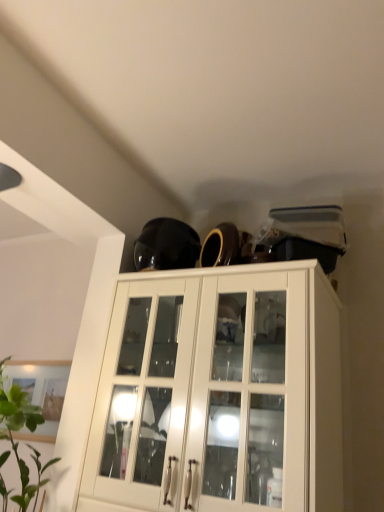
This screenshot has height=512, width=384. What do you see at coordinates (219, 394) in the screenshot? I see `white glossy cabinet at upper center` at bounding box center [219, 394].

This screenshot has width=384, height=512. Identify the location of white glossy cabinet at upper center. (219, 394).

What do you see at coordinates (17, 442) in the screenshot?
I see `green leafy plant at lower left` at bounding box center [17, 442].

The image size is (384, 512). In order to click on green leafy plant at lower left in this screenshot , I will do [17, 442].

What is the approximate height of green leafy plant at lower left?

38.68 centimeters.

Locate an element on the screen. The image size is (384, 512). white glossy cabinet at upper center is located at coordinates (219, 394).

Considering the positions of objects green leafy plant at lower left and white glossy cabinet at upper center in the image provided, who is more to the right, green leafy plant at lower left or white glossy cabinet at upper center?

From the viewer's perspective, white glossy cabinet at upper center appears more on the right side.

Does green leafy plant at lower left lie in front of white glossy cabinet at upper center?

Yes.

Is point (21, 465) farther from camera compared to point (156, 509)?

Yes, it is.

From the image's perspective, which one is positioned higher, green leafy plant at lower left or white glossy cabinet at upper center?

green leafy plant at lower left.

From a real-world perspective, relative to white glossy cabinet at upper center, is green leafy plant at lower left vertically above or below?

From a real-world perspective, green leafy plant at lower left is physically below white glossy cabinet at upper center.

Looking at their sizes, would you say green leafy plant at lower left is wider or thinner than white glossy cabinet at upper center?

green leafy plant at lower left is thinner than white glossy cabinet at upper center.

Who is shorter, green leafy plant at lower left or white glossy cabinet at upper center?

Standing shorter between the two is green leafy plant at lower left.

Which of these two, green leafy plant at lower left or white glossy cabinet at upper center, is smaller?

Smaller between the two is green leafy plant at lower left.

In the scene shown: Is green leafy plant at lower left inside the boundaries of white glossy cabinet at upper center, or outside?

green leafy plant at lower left is spatially situated outside white glossy cabinet at upper center.

Are green leafy plant at lower left and white glossy cabinet at upper center far apart?

That's not correct — green leafy plant at lower left is a little close to white glossy cabinet at upper center.

From the picture: Is green leafy plant at lower left oriented away from white glossy cabinet at upper center?

No, green leafy plant at lower left is not facing the opposite direction of white glossy cabinet at upper center.

How different are the orientations of green leafy plant at lower left and white glossy cabinet at upper center in degrees?

The facing directions of green leafy plant at lower left and white glossy cabinet at upper center are 90 degrees apart.

Image resolution: width=384 pixels, height=512 pixels. In order to click on houseplant lying in front of the white glossy cabinet at upper center in this screenshot , I will do `click(17, 442)`.

Between white glossy cabinet at upper center and green leafy plant at lower left, which one appears on the right side from the viewer's perspective?

white glossy cabinet at upper center is more to the right.

Considering their positions, is white glossy cabinet at upper center located in front of or behind green leafy plant at lower left?

white glossy cabinet at upper center is positioned farther from the viewer than green leafy plant at lower left.

Is point (312, 390) farther from viewer compared to point (22, 407)?

That is False.

From the image's perspective, is white glossy cabinet at upper center over green leafy plant at lower left?

No, from the image's perspective, white glossy cabinet at upper center is not above green leafy plant at lower left.

From a real-world perspective, is white glossy cabinet at upper center positioned above or below green leafy plant at lower left?

From a real-world perspective, white glossy cabinet at upper center is physically above green leafy plant at lower left.

In the scene shown: Between white glossy cabinet at upper center and green leafy plant at lower left, which one has smaller width?

Thinner between the two is green leafy plant at lower left.

Who is taller, white glossy cabinet at upper center or green leafy plant at lower left?

Standing taller between the two is white glossy cabinet at upper center.

Can you confirm if white glossy cabinet at upper center is bigger than green leafy plant at lower left?

Yes.

Choose the correct answer: Is white glossy cabinet at upper center inside green leafy plant at lower left or outside it?

white glossy cabinet at upper center is spatially situated outside green leafy plant at lower left.

Are white glossy cabinet at upper center and green leafy plant at lower left far apart?

No, white glossy cabinet at upper center is in close proximity to green leafy plant at lower left.

Is white glossy cabinet at upper center turned away from green leafy plant at lower left?

That's not correct — white glossy cabinet at upper center is not looking away from green leafy plant at lower left.

Locate an element on the screen. Image resolution: width=384 pixels, height=512 pixels. cabinetry behind the green leafy plant at lower left is located at coordinates (219, 394).

Identify the location of houseplant in front of the white glossy cabinet at upper center. (17, 442).

The image size is (384, 512). I want to click on cabinetry below the green leafy plant at lower left (from the image's perspective), so click(219, 394).